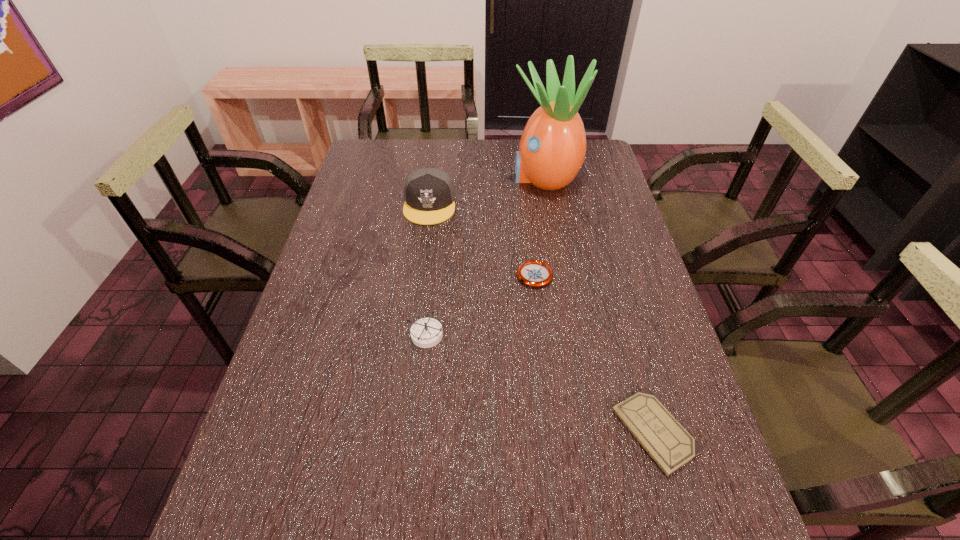
The image size is (960, 540). Find the location of `free space between the pineapple and the checkbook`. free space between the pineapple and the checkbook is located at coordinates (600, 304).

This screenshot has width=960, height=540. In order to click on empty location between the fourth farthest object and the pineapple in this screenshot , I will do `click(485, 256)`.

You are a GUI agent. You are given a task and a screenshot of the screen. Output one action in this format:
    pyautogui.click(x=<x>, y=<y>)
    Task: Click on the free space between the shortest object and the third farthest object
    The width and height of the screenshot is (960, 540).
    Given the screenshot: What is the action you would take?
    pyautogui.click(x=595, y=353)

This screenshot has height=540, width=960. What are the coordinates of `the second closest object to the pineapple` in the screenshot? It's located at (533, 273).

This screenshot has height=540, width=960. Find the location of `object that is the second closest one to the taller compass`. object that is the second closest one to the taller compass is located at coordinates (429, 193).

Image resolution: width=960 pixels, height=540 pixels. Identify the location of vacant space that satisfies the following two spatial constraints: 1. on the back side of the checkbook; 2. at the entrance of the tallest object. (583, 177).

The height and width of the screenshot is (540, 960). Find the location of `free location that satisfies the following two spatial constraints: 1. on the front-facing side of the second tallest object; 2. on the left side of the nearest object`. free location that satisfies the following two spatial constraints: 1. on the front-facing side of the second tallest object; 2. on the left side of the nearest object is located at coordinates (400, 431).

You are a GUI agent. You are given a task and a screenshot of the screen. Output one action in this format:
    pyautogui.click(x=<x>, y=<y>)
    Task: Click on the vacant space that satisfies the following two spatial constraints: 1. at the entrance of the tallest object; 2. on the right side of the checkbook
    
    Given the screenshot: What is the action you would take?
    pyautogui.click(x=590, y=431)

What are the coordinates of `vacant space that satisfies the following two spatial constraints: 1. on the front-facing side of the nearer compass; 2. on the left side of the second tallest object` in the screenshot? It's located at (413, 335).

Identify the location of free space in the image that satisfies the following two spatial constraints: 1. on the front-facing side of the third farthest object; 2. on the left side of the second tallest object. (420, 275).